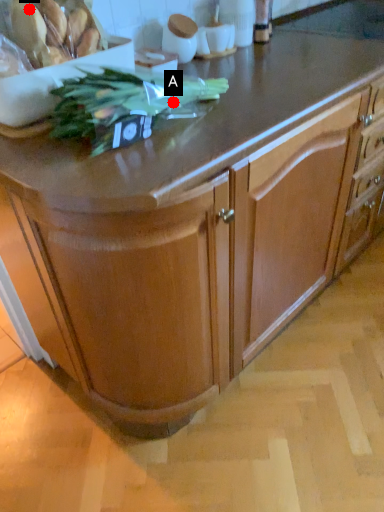
Question: Two points are circled on the image, labeled by A and B beside each circle. Which point is closer to the camera taking this photo?

Choices:
 (A) A is closer
 (B) B is closer

Answer: (B)